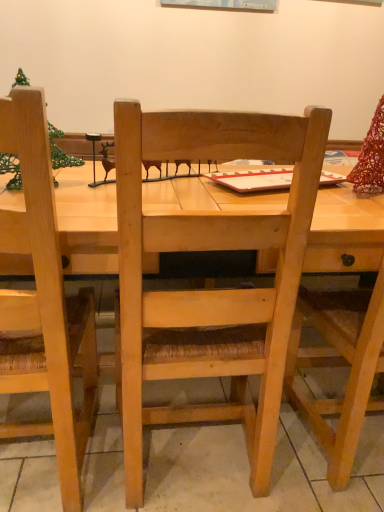
Question: Is natural wood chair at center, positioned as the second chair in left-to-right order, in front of or behind natural wood chair at left, which is the 1th chair in left-to-right order, in the image?

Choices:
 (A) behind
 (B) front

Answer: (A)

Question: Considering the positions of natural wood chair at center, the first chair when ordered from right to left, and natural wood chair at left, which is the 1th chair in left-to-right order, in the image, is natural wood chair at center, the first chair when ordered from right to left, bigger or smaller than natural wood chair at left, which is the 1th chair in left-to-right order,?

Choices:
 (A) big
 (B) small

Answer: (A)

Question: Considering the positions of natural wood chair at center, positioned as the second chair in left-to-right order, and natural wood chair at left, which is the 1th chair in left-to-right order, in the image, is natural wood chair at center, positioned as the second chair in left-to-right order, wider or thinner than natural wood chair at left, which is the 1th chair in left-to-right order,?

Choices:
 (A) wide
 (B) thin

Answer: (A)

Question: From the image's perspective, relative to natural wood chair at center, positioned as the second chair in left-to-right order, is natural wood chair at left, which is the 1th chair in left-to-right order, above or below?

Choices:
 (A) below
 (B) above

Answer: (A)

Question: Is natural wood chair at left, marked as the second chair in a right-to-left arrangement, wider or thinner than natural wood chair at center, the first chair when ordered from right to left?

Choices:
 (A) wide
 (B) thin

Answer: (B)

Question: From a real-world perspective, is natural wood chair at left, marked as the second chair in a right-to-left arrangement, physically located above or below natural wood chair at center, positioned as the second chair in left-to-right order?

Choices:
 (A) below
 (B) above

Answer: (B)

Question: In the image, is natural wood chair at left, which is the 1th chair in left-to-right order, on the left side or the right side of natural wood chair at center, positioned as the second chair in left-to-right order?

Choices:
 (A) right
 (B) left

Answer: (B)